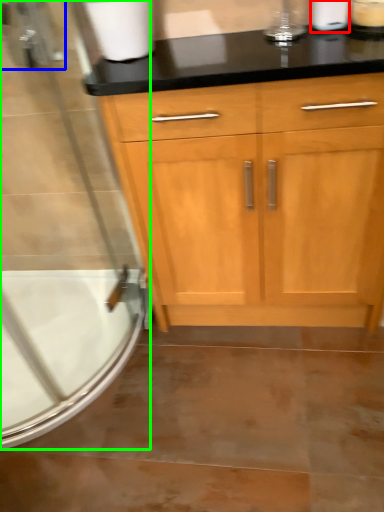
Question: Which is nearer to the toilet paper (highlighted by a red box)? faucet (highlighted by a blue box) or screen door (highlighted by a green box).

Choices:
 (A) faucet
 (B) screen door

Answer: (A)